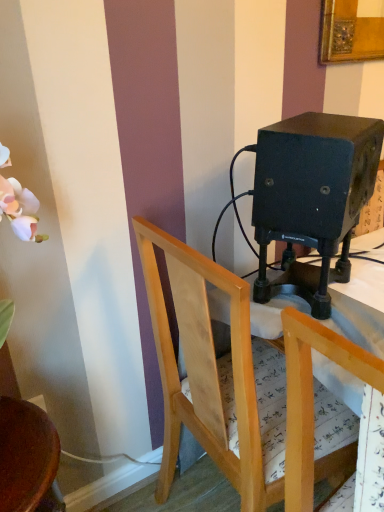
Question: From a real-world perspective, is light wood chair at center, the third chair from the left, on top of wooden chair at lower left, which is counted as the 3th chair, starting from the right?

Choices:
 (A) no
 (B) yes

Answer: (B)

Question: Considering the relative sizes of light wood chair at center, the third chair from the left, and wooden chair at lower left, which is counted as the 3th chair, starting from the right, in the image provided, is light wood chair at center, the third chair from the left, thinner than wooden chair at lower left, which is counted as the 3th chair, starting from the right,?

Choices:
 (A) yes
 (B) no

Answer: (B)

Question: From a real-world perspective, is light wood chair at center, positioned as the first chair in right-to-left order, physically below wooden chair at lower left, which is counted as the 3th chair, starting from the right?

Choices:
 (A) no
 (B) yes

Answer: (A)

Question: From the image's perspective, is light wood chair at center, the third chair from the left, under wooden chair at lower left, the first chair when ordered from left to right?

Choices:
 (A) no
 (B) yes

Answer: (A)

Question: Are light wood chair at center, positioned as the first chair in right-to-left order, and wooden chair at lower left, the first chair when ordered from left to right, beside each other?

Choices:
 (A) yes
 (B) no

Answer: (B)

Question: In terms of width, does wooden chair at center, which is the second chair from left to right, look wider or thinner when compared to wooden chair at lower left, the first chair when ordered from left to right?

Choices:
 (A) wide
 (B) thin

Answer: (A)

Question: From a real-world perspective, is wooden chair at center, placed as the second chair when sorted from right to left, positioned above or below wooden chair at lower left, the first chair when ordered from left to right?

Choices:
 (A) below
 (B) above

Answer: (B)

Question: Considering the positions of wooden chair at center, placed as the second chair when sorted from right to left, and wooden chair at lower left, which is counted as the 3th chair, starting from the right, in the image, is wooden chair at center, placed as the second chair when sorted from right to left, taller or shorter than wooden chair at lower left, which is counted as the 3th chair, starting from the right,?

Choices:
 (A) short
 (B) tall

Answer: (B)

Question: Would you say wooden chair at center, which is the second chair from left to right, is inside or outside wooden chair at lower left, the first chair when ordered from left to right?

Choices:
 (A) inside
 (B) outside

Answer: (B)

Question: In terms of size, does wooden chair at center, which is the second chair from left to right, appear bigger or smaller than light wood chair at center, positioned as the first chair in right-to-left order?

Choices:
 (A) small
 (B) big

Answer: (B)

Question: From their relative heights in the image, would you say wooden chair at center, placed as the second chair when sorted from right to left, is taller or shorter than light wood chair at center, the third chair from the left?

Choices:
 (A) tall
 (B) short

Answer: (A)

Question: Considering the positions of wooden chair at center, which is the second chair from left to right, and light wood chair at center, the third chair from the left, in the image, is wooden chair at center, which is the second chair from left to right, wider or thinner than light wood chair at center, the third chair from the left,?

Choices:
 (A) thin
 (B) wide

Answer: (B)

Question: Is wooden chair at center, placed as the second chair when sorted from right to left, situated inside light wood chair at center, positioned as the first chair in right-to-left order, or outside?

Choices:
 (A) inside
 (B) outside

Answer: (B)

Question: Considering their positions, is light wood chair at center, the third chair from the left, located in front of or behind wooden chair at center, placed as the second chair when sorted from right to left?

Choices:
 (A) front
 (B) behind

Answer: (A)

Question: Based on their sizes in the image, would you say light wood chair at center, the third chair from the left, is bigger or smaller than wooden chair at center, which is the second chair from left to right?

Choices:
 (A) big
 (B) small

Answer: (B)